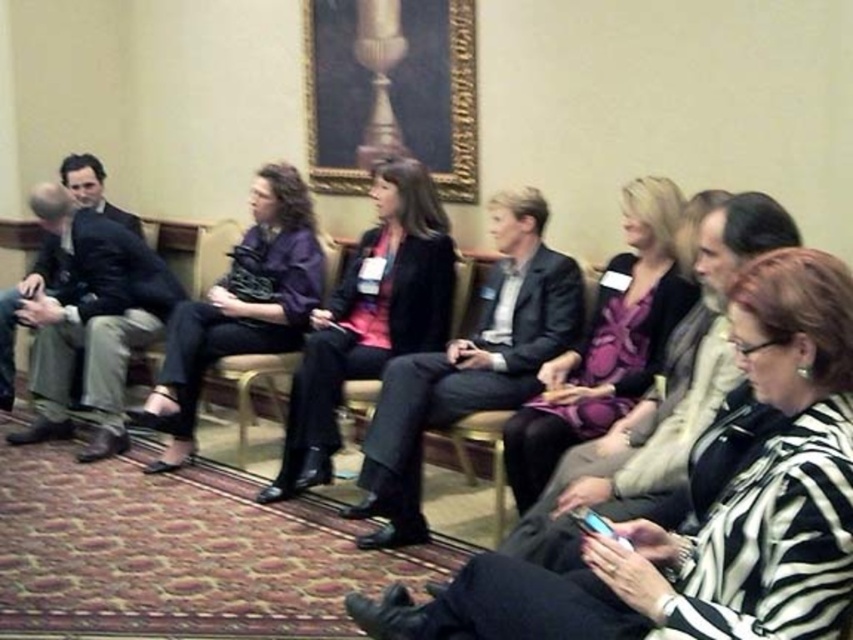
You are an interior designer who needs to ensure that the matte purple blouse at center does not get stained by any spills from the metallic gold chair at center. Based on their positions, is there a risk of the blouse touching the chair?

The matte purple blouse at center is positioned over metallic gold chair at center, so there is a risk of the blouse touching the chair, increasing the chance of stains from spills.

You are organizing a photoshoot and need to ensure that the matte black blazer at center and the metallic gold chair at center are visible in the frame. Since the chair is part of the seating arrangement, can you adjust the camera angle so that both items are fully visible without one blocking the other?

The matte black blazer at center is positioned over the metallic gold chair at center, so adjusting the camera angle might not fully reveal both items without one blocking the other. Consider moving the blazer or repositioning the chair to ensure visibility.

You are attending a meeting and need to sit down. You see the matte purple blouse at center and the metallic gold chair at center. Which object is closer to you?

The matte purple blouse at center is closer to you because the metallic gold chair at center is behind it.